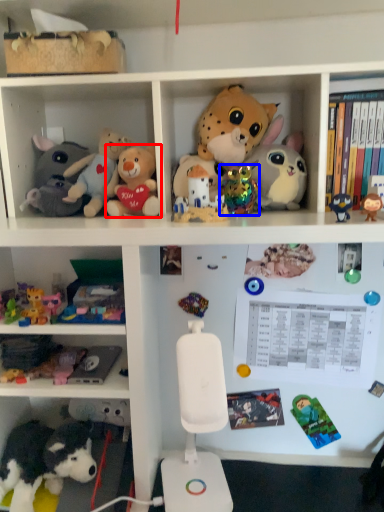
Question: Which of the following is the farthest to the observer, toy (highlighted by a red box) or toy (highlighted by a blue box)?

Choices:
 (A) toy
 (B) toy

Answer: (B)